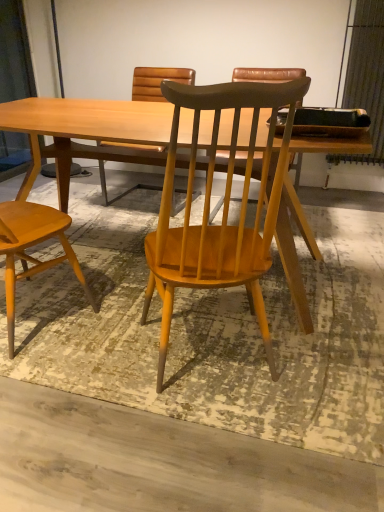
Question: Is wooden chair at center, arranged as the second chair when viewed from the left, behind light wood table at center?

Choices:
 (A) no
 (B) yes

Answer: (A)

Question: Is wooden chair at center, arranged as the second chair when viewed from the left, looking in the opposite direction of light wood table at center?

Choices:
 (A) yes
 (B) no

Answer: (B)

Question: Is wooden chair at center, the first chair in the right-to-left sequence, bigger than light wood table at center?

Choices:
 (A) yes
 (B) no

Answer: (B)

Question: From a real-world perspective, is wooden chair at center, arranged as the second chair when viewed from the left, located beneath light wood table at center?

Choices:
 (A) yes
 (B) no

Answer: (B)

Question: Does wooden chair at center, arranged as the second chair when viewed from the left, have a greater height compared to light wood table at center?

Choices:
 (A) no
 (B) yes

Answer: (B)

Question: In terms of size, does light brown wood chair at left, positioned as the 2th chair in right-to-left order, appear bigger or smaller than wooden chair at center, the first chair in the right-to-left sequence?

Choices:
 (A) big
 (B) small

Answer: (A)

Question: Is light brown wood chair at left, positioned as the 2th chair in right-to-left order, spatially inside wooden chair at center, the first chair in the right-to-left sequence, or outside of it?

Choices:
 (A) outside
 (B) inside

Answer: (A)

Question: In terms of height, does light brown wood chair at left, positioned as the 2th chair in right-to-left order, look taller or shorter compared to wooden chair at center, arranged as the second chair when viewed from the left?

Choices:
 (A) tall
 (B) short

Answer: (B)

Question: From the image's perspective, relative to wooden chair at center, the first chair in the right-to-left sequence, is light brown wood chair at left, positioned as the 2th chair in right-to-left order, above or below?

Choices:
 (A) above
 (B) below

Answer: (A)

Question: From a real-world perspective, is light wood table at center positioned above or below light brown wood chair at left, the 1th chair when ordered from left to right?

Choices:
 (A) above
 (B) below

Answer: (B)

Question: Considering their positions, is light wood table at center located in front of or behind light brown wood chair at left, the 1th chair when ordered from left to right?

Choices:
 (A) behind
 (B) front

Answer: (A)

Question: Based on their positions, is light wood table at center located to the left or right of light brown wood chair at left, positioned as the 2th chair in right-to-left order?

Choices:
 (A) right
 (B) left

Answer: (A)

Question: Does point (117, 133) appear closer or farther from the camera than point (43, 234)?

Choices:
 (A) farther
 (B) closer

Answer: (B)

Question: From a real-world perspective, is light brown wood chair at left, the 1th chair when ordered from left to right, physically located above or below light wood table at center?

Choices:
 (A) above
 (B) below

Answer: (A)

Question: Relative to light wood table at center, is light brown wood chair at left, the 1th chair when ordered from left to right, in front or behind?

Choices:
 (A) behind
 (B) front

Answer: (B)